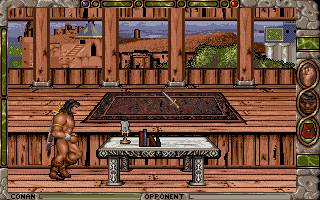
Identify the location of stairs. This screenshot has height=200, width=320. (73, 51).